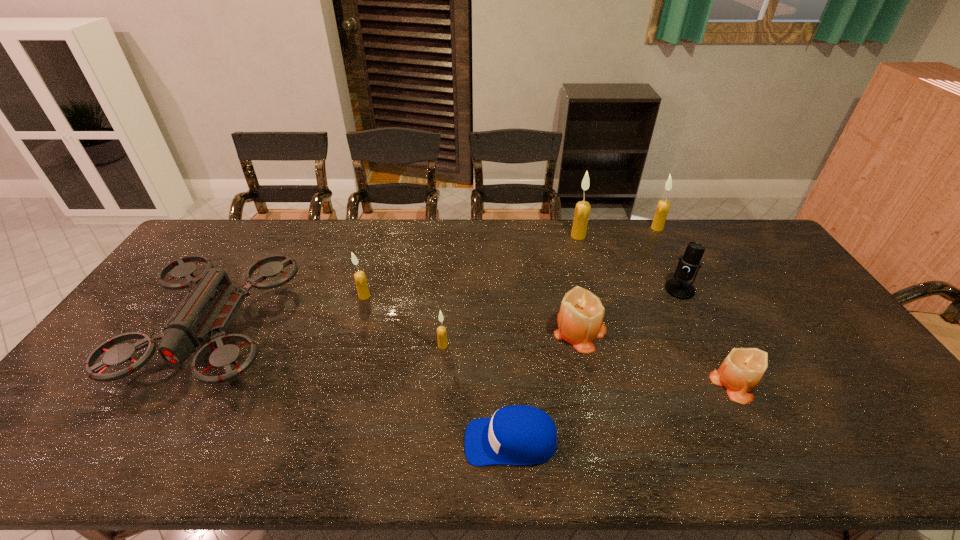
The image size is (960, 540). I want to click on cream candle that is the second closest to the fifth shortest candle, so click(441, 330).

Identify the location of vacant region that satisfies the following two spatial constraints: 1. on the front-facing side of the gray drone; 2. on the right side of the smallest cream candle. This screenshot has height=540, width=960. (204, 346).